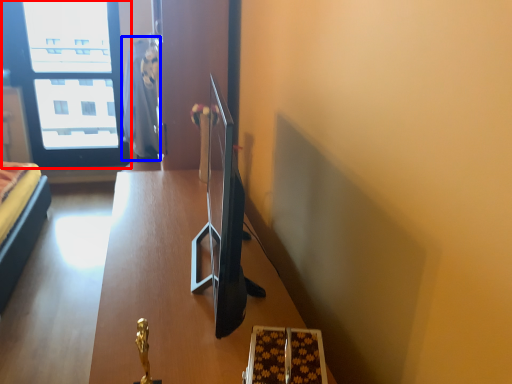
Question: Which point is further to the camera, window (highlighted by a red box) or robe (highlighted by a blue box)?

Choices:
 (A) window
 (B) robe

Answer: (A)